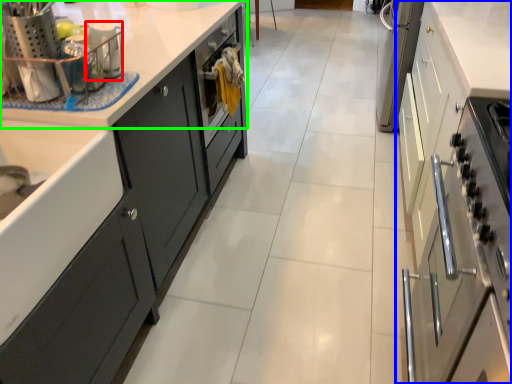
Question: Which object is the farthest from appliance (highlighted by a red box)? Choose among these: cabinetry (highlighted by a blue box) or countertop (highlighted by a green box).

Choices:
 (A) cabinetry
 (B) countertop

Answer: (A)